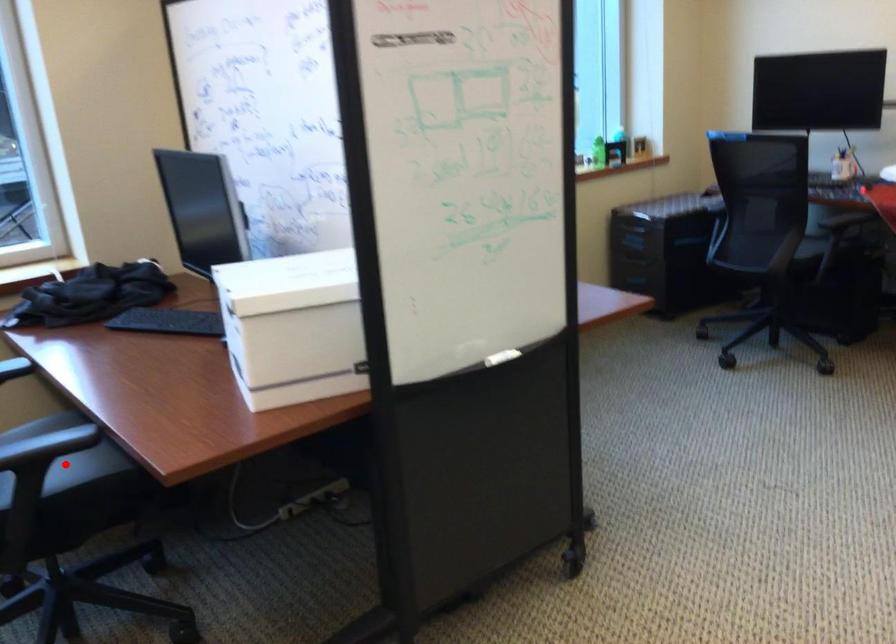
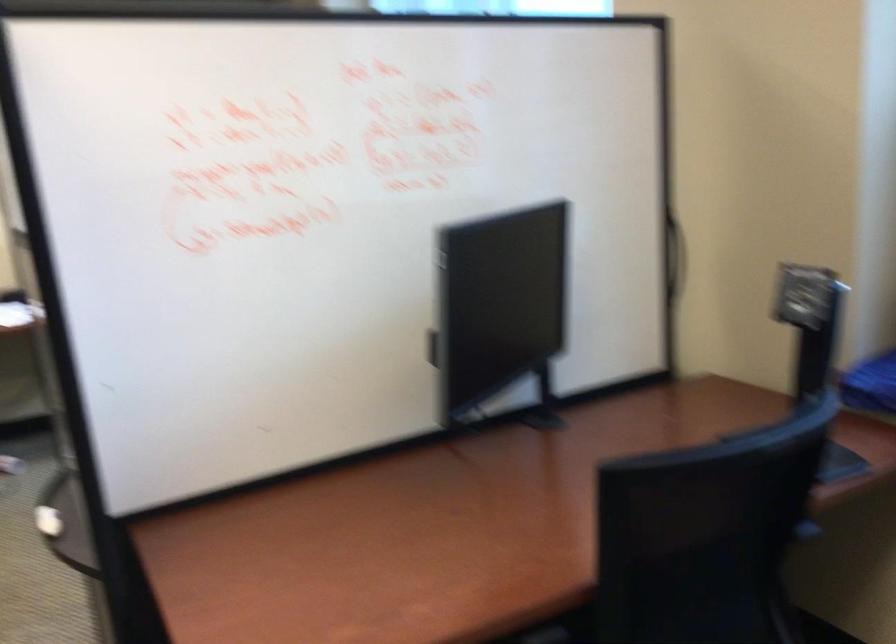
Question: I am providing you with two images of the same scene from different viewpoints. A red point is marked on the first image. Is the red point's position out of view in image 2?

Choices:
 (A) Yes
 (B) No

Answer: (A)